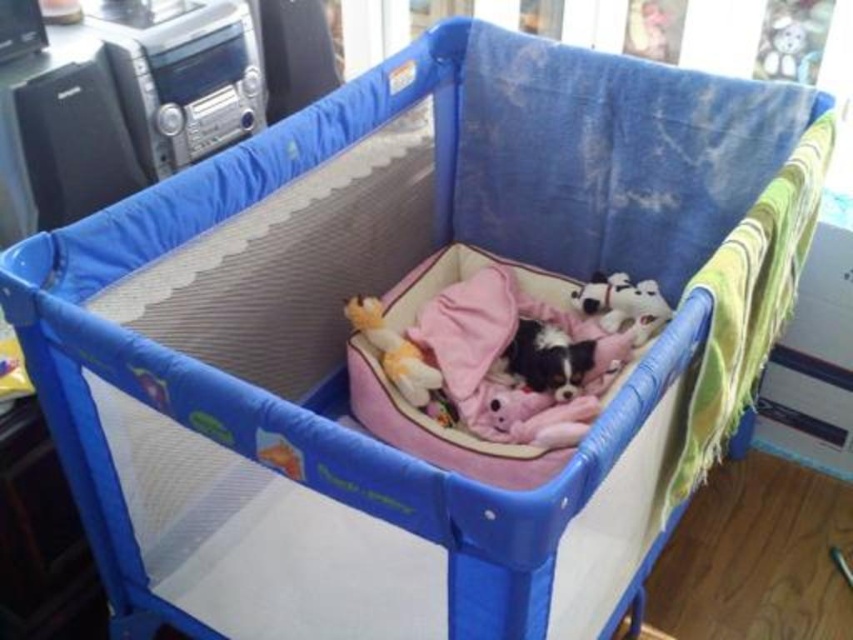
Question: Which of the following is the closest to the observer?

Choices:
 (A) (595, 298)
 (B) (784, 3)
 (C) (393, 378)

Answer: (C)

Question: Which object is positioned closest to the white plush dog at upper right?

Choices:
 (A) white plush bear at upper right
 (B) soft plush toy at center

Answer: (B)

Question: Which object is positioned closest to the white plush bear at upper right?

Choices:
 (A) soft plush toy at center
 (B) white plush dog at upper right

Answer: (B)

Question: Does soft plush toy at center appear on the left side of white plush dog at upper right?

Choices:
 (A) no
 (B) yes

Answer: (B)

Question: Does white plush bear at upper right appear under soft plush toy at center?

Choices:
 (A) yes
 (B) no

Answer: (B)

Question: From the image, what is the correct spatial relationship of white plush bear at upper right in relation to white plush dog at upper right?

Choices:
 (A) left
 (B) right

Answer: (B)